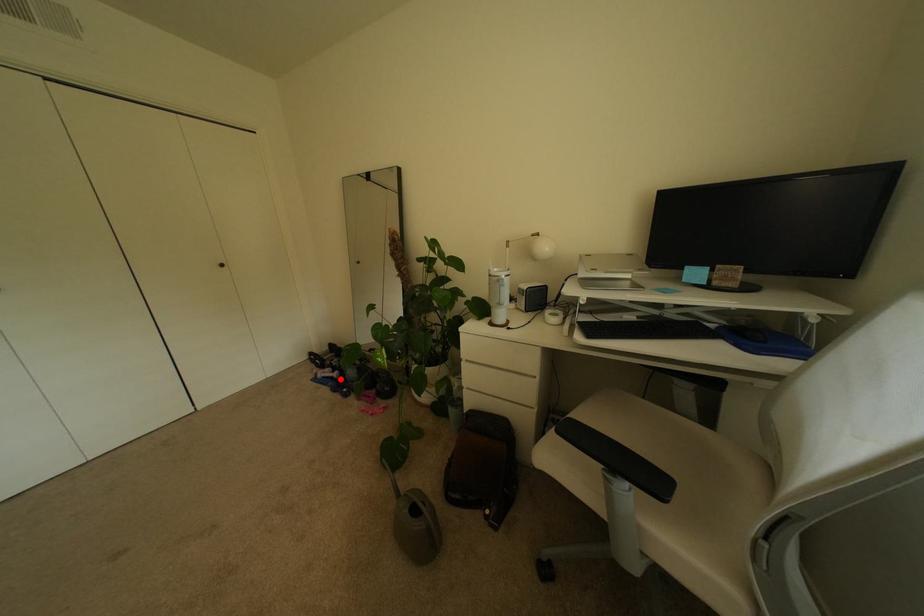
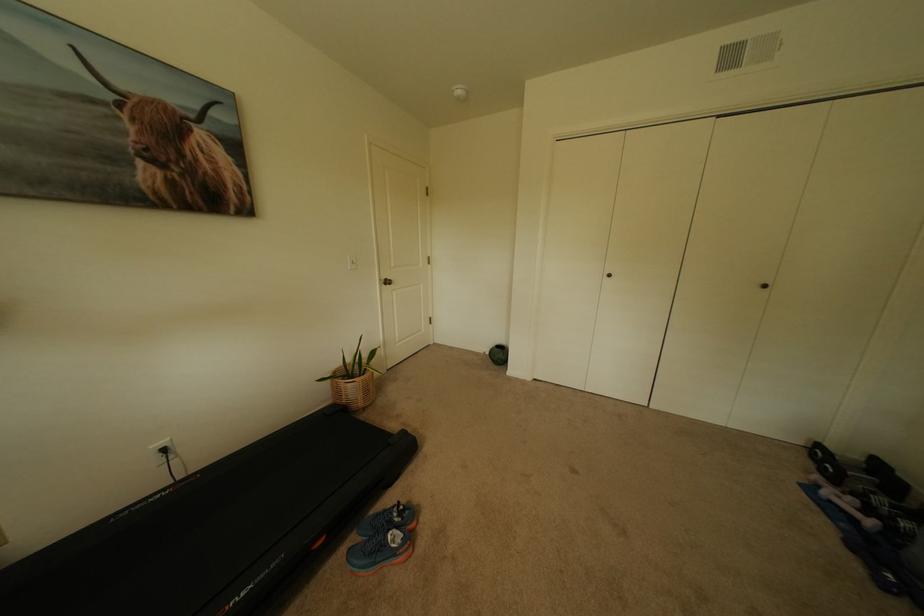
Question: I am providing you with two images of the same scene from different viewpoints. A red point is marked on the first image. Is the red point's position out of view in image 2?

Choices:
 (A) Yes
 (B) No

Answer: (B)